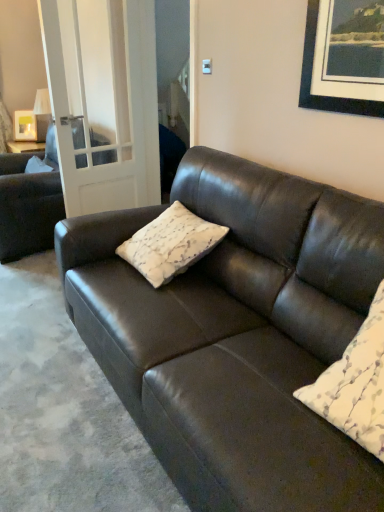
Question: From their relative heights in the image, would you say white textured pillow at center, arranged as the 1th pillow when viewed from the right, is taller or shorter than matte white picture frame at upper left?

Choices:
 (A) tall
 (B) short

Answer: (A)

Question: From a real-world perspective, is white textured pillow at center, acting as the first pillow starting from the front, positioned above or below matte white picture frame at upper left?

Choices:
 (A) below
 (B) above

Answer: (A)

Question: Which object is the closest to the matte black couch at left, the 1th studio couch when ordered from back to front?

Choices:
 (A) white textured pillow at center, the 2th pillow positioned from the front
 (B) matte white picture frame at upper left
 (C) clear glass door at left
 (D) white textured pillow at center, arranged as the 1th pillow when viewed from the right
 (E) matte black couch at center, the 2th studio couch positioned from the left

Answer: (C)

Question: Considering the real-world distances, which object is farthest from the matte black couch at center, the 2th studio couch positioned from the left?

Choices:
 (A) white textured pillow at center, placed as the first pillow when sorted from left to right
 (B) white textured pillow at center, arranged as the 1th pillow when viewed from the right
 (C) matte white picture frame at upper left
 (D) clear glass door at left
 (E) matte black couch at left, placed as the second studio couch when sorted from front to back

Answer: (C)